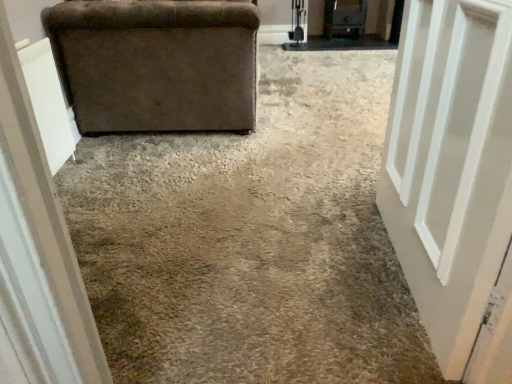
Question: Considering the relative sizes of white painted wood door at right and velvet brown armchair at left in the image provided, is white painted wood door at right shorter than velvet brown armchair at left?

Choices:
 (A) yes
 (B) no

Answer: (B)

Question: From a real-world perspective, is white painted wood door at right on velvet brown armchair at left?

Choices:
 (A) yes
 (B) no

Answer: (A)

Question: Is white painted wood door at right turned away from velvet brown armchair at left?

Choices:
 (A) no
 (B) yes

Answer: (A)

Question: Could you tell me if white painted wood door at right is facing velvet brown armchair at left?

Choices:
 (A) no
 (B) yes

Answer: (A)

Question: From the image's perspective, is white painted wood door at right above velvet brown armchair at left?

Choices:
 (A) no
 (B) yes

Answer: (A)

Question: Are white painted wood door at right and velvet brown armchair at left located far from each other?

Choices:
 (A) yes
 (B) no

Answer: (A)

Question: Considering the relative positions of brown fabric couch at upper left and white painted wood door at right in the image provided, is brown fabric couch at upper left in front of white painted wood door at right?

Choices:
 (A) no
 (B) yes

Answer: (A)

Question: From the image's perspective, is brown fabric couch at upper left under white painted wood door at right?

Choices:
 (A) yes
 (B) no

Answer: (B)

Question: Can you confirm if brown fabric couch at upper left is bigger than white painted wood door at right?

Choices:
 (A) yes
 (B) no

Answer: (A)

Question: Is brown fabric couch at upper left not inside white painted wood door at right?

Choices:
 (A) yes
 (B) no

Answer: (A)

Question: Is brown fabric couch at upper left turned away from white painted wood door at right?

Choices:
 (A) no
 (B) yes

Answer: (A)

Question: Is brown fabric couch at upper left shorter than white painted wood door at right?

Choices:
 (A) no
 (B) yes

Answer: (B)

Question: From the image's perspective, would you say brown fabric couch at upper left is shown under velvet brown armchair at left?

Choices:
 (A) no
 (B) yes

Answer: (B)